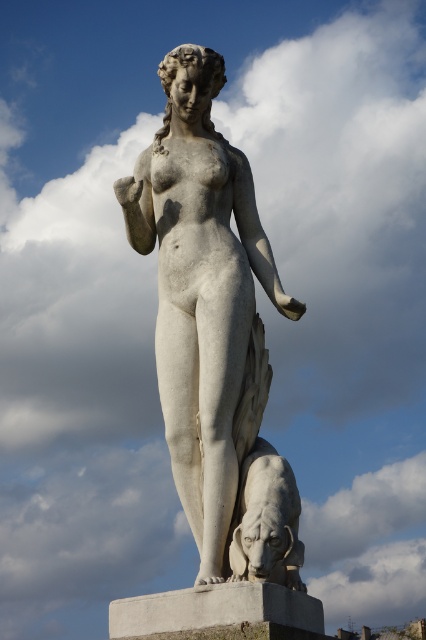
You are a photographer standing in front of the classical statue. You want to take a photo that includes both the statue and the animal at the base. However, you notice two points marked on your camera screen at coordinates point (196,216) and point (259,468). Which point is closer to your camera lens?

Point (196,216) is further to the camera than point (259,468), so the point closer to the camera lens is point (259,468).

You are an art student who wants to create a miniature model of the scene. The model must maintain the same proportions between the white marble statue at center and the white marble lion at lower center. If the lion in your model is 2 inches tall, how tall should the statue be?

The white marble statue at center is much taller than the white marble lion at lower center. So if the lion is 2 inches tall in the model, the statue should be significantly taller to maintain the same proportions.